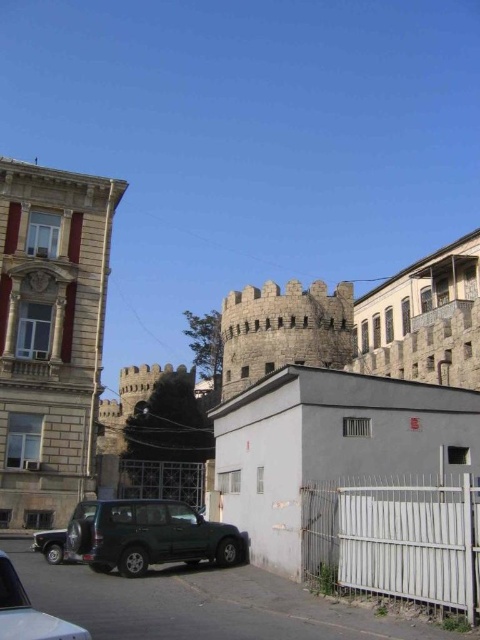
Is point (88, 320) positioned before point (7, 604)?

No, it is not.

Does smooth stone tower at left lie behind dark green matte suv at lower left?

That is True.

Image resolution: width=480 pixels, height=640 pixels. What do you see at coordinates (50, 336) in the screenshot?
I see `smooth stone tower at left` at bounding box center [50, 336].

I want to click on smooth stone tower at left, so click(50, 336).

Who is taller, white metal fence at lower right or dark green matte suv at lower left?

white metal fence at lower right

Is white metal fence at lower right positioned at the back of dark green matte suv at lower left?

That is True.

Is point (467, 532) less distant than point (25, 596)?

That is False.

Identify the location of white metal fence at lower right. The width and height of the screenshot is (480, 640). (396, 538).

Is smooth stone tower at left to the right of dark green matte suv at center from the viewer's perspective?

No, smooth stone tower at left is not to the right of dark green matte suv at center.

Describe the element at coordinates (50, 336) in the screenshot. I see `smooth stone tower at left` at that location.

Locate an element on the screen. smooth stone tower at left is located at coordinates (50, 336).